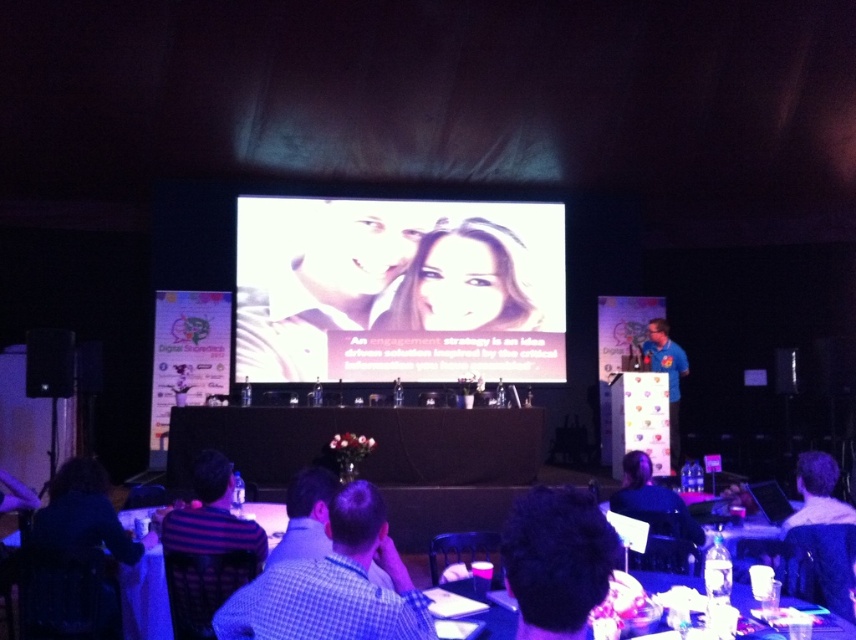
Question: Among these points, which one is farthest from the camera?

Choices:
 (A) (372, 550)
 (B) (502, 628)

Answer: (B)

Question: Is white glossy projection screen at center to the right of smooth skin face at center from the viewer's perspective?

Choices:
 (A) yes
 (B) no

Answer: (B)

Question: Where is checkered shirt at lower center located in relation to blue shirt at right in the image?

Choices:
 (A) left
 (B) right

Answer: (A)

Question: In this image, where is smooth skin face at center located relative to translucent plastic table at lower center?

Choices:
 (A) below
 (B) above

Answer: (B)

Question: Which point is closer to the camera taking this photo?

Choices:
 (A) (331, 632)
 (B) (462, 260)
 (C) (453, 292)

Answer: (A)

Question: Considering the real-world distances, which object is closest to the white glossy projection screen at center?

Choices:
 (A) blue shirt at right
 (B) checkered shirt at lower center

Answer: (A)